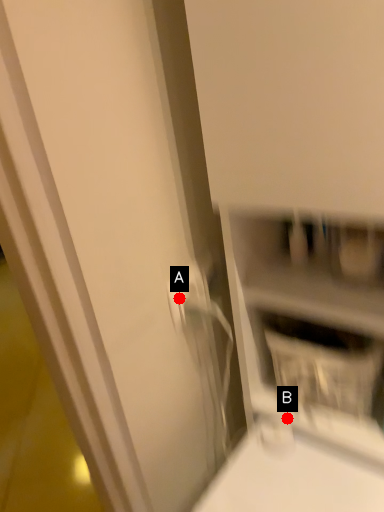
Question: Two points are circled on the image, labeled by A and B beside each circle. Which point appears closest to the camera in this image?

Choices:
 (A) A is closer
 (B) B is closer

Answer: (A)